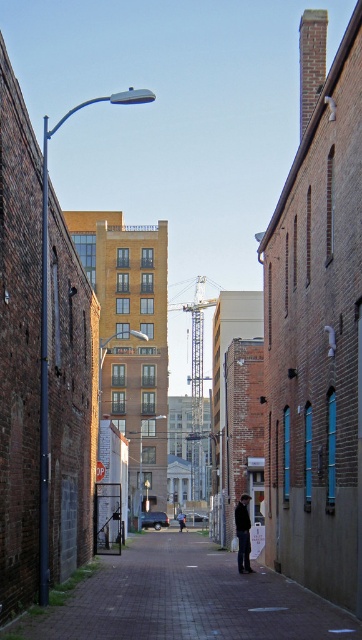
Is brick wall at center above dark brown leather jacket at center?

Yes, brick wall at center is above dark brown leather jacket at center.

Is point (304, 396) positioned after point (247, 541)?

No, it is not.

Who is more distant from viewer, (306, 368) or (238, 540)?

The point (238, 540) is more distant.

At what (x,y) coordinates should I click in order to perform the action: click on brick wall at center. Please return your answer as a coordinate pair (x, y). Looking at the image, I should click on (317, 330).

Does metallic pole at left have a greater width compared to dark brown leather jacket at center?

Yes, metallic pole at left is wider than dark brown leather jacket at center.

Is the position of metallic pole at left more distant than that of dark brown leather jacket at center?

No.

Find the location of a particular element. metallic pole at left is located at coordinates (18, 344).

I want to click on metallic pole at left, so 18,344.

Does metallic pole at left lie in front of paved brick pavement at center?

Yes, metallic pole at left is in front of paved brick pavement at center.

Which is behind, point (32, 173) or point (275, 602)?

Point (275, 602)

You are a GUI agent. You are given a task and a screenshot of the screen. Output one action in this format:
    pyautogui.click(x=<x>, y=<y>)
    Task: Click on the metallic pole at left
    
    Given the screenshot: What is the action you would take?
    pyautogui.click(x=18, y=344)